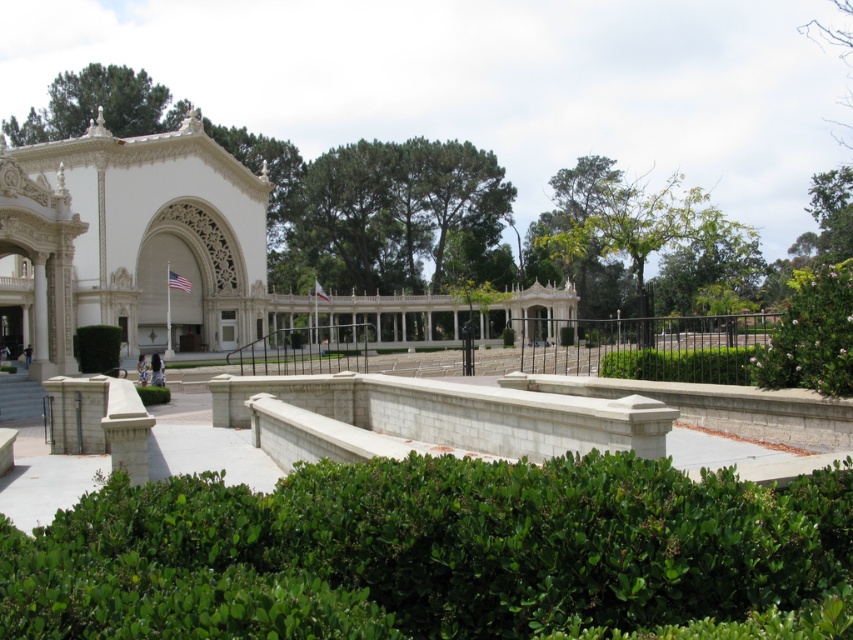
Is white stone palace at center further to camera compared to green leafy tree at center?

No, it is not.

Is white stone palace at center below green leafy tree at center?

Yes.

Identify the location of white stone palace at center. The image size is (853, 640). (135, 243).

This screenshot has width=853, height=640. I want to click on white stone palace at center, so click(x=135, y=243).

Is green leafy hedge at lower center bigger than green leafy tree at center?

Incorrect, green leafy hedge at lower center is not larger than green leafy tree at center.

Is green leafy hedge at lower center wider than green leafy tree at center?

In fact, green leafy hedge at lower center might be narrower than green leafy tree at center.

At what (x,y) coordinates should I click in order to perform the action: click on green leafy hedge at lower center. Please return your answer as a coordinate pair (x, y). The height and width of the screenshot is (640, 853). Looking at the image, I should click on (430, 552).

Image resolution: width=853 pixels, height=640 pixels. Describe the element at coordinates (131, 241) in the screenshot. I see `white stone palace at left` at that location.

Can you confirm if white stone palace at left is bigger than green leafy bush at lower center?

Indeed, white stone palace at left has a larger size compared to green leafy bush at lower center.

Identify the location of white stone palace at left. The image size is (853, 640). (131, 241).